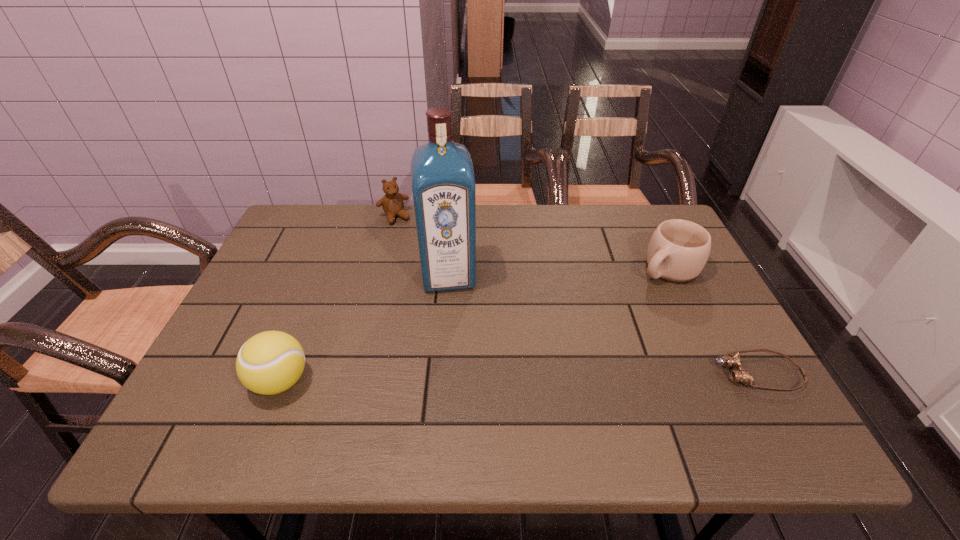
Identify the location of mug that is at the far edge. This screenshot has height=540, width=960. (678, 250).

Identify the location of teddy bear that is at the far edge. pos(392,203).

You are a GUI agent. You are given a task and a screenshot of the screen. Output one action in this format:
    pyautogui.click(x=<x>, y=<y>)
    Task: Click on the tennis ball at the near edge
    This screenshot has width=960, height=540.
    Given the screenshot: What is the action you would take?
    pyautogui.click(x=271, y=362)

The height and width of the screenshot is (540, 960). Identify the location of goggles at the near edge. (740, 375).

Find the location of a particular element. The width and height of the screenshot is (960, 540). object that is at the left edge is located at coordinates (271, 362).

The image size is (960, 540). Find the location of `goggles located at the right edge`. goggles located at the right edge is located at coordinates (740, 375).

You are a GUI agent. You are given a task and a screenshot of the screen. Output one action in this format:
    pyautogui.click(x=<x>, y=<y>)
    Task: Click on the mug that is at the right edge
    The width and height of the screenshot is (960, 540).
    Given the screenshot: What is the action you would take?
    pyautogui.click(x=678, y=250)

Locate an element on the screen. The image size is (960, 540). object present at the near left corner is located at coordinates (271, 362).

Where is `object located at the far right corner`? object located at the far right corner is located at coordinates (678, 250).

Image resolution: width=960 pixels, height=540 pixels. I want to click on object located in the near right corner section of the desktop, so click(x=740, y=375).